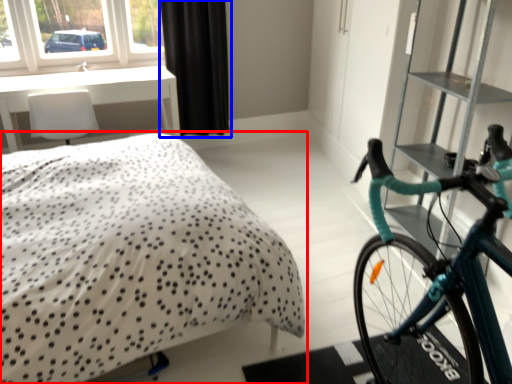
Question: Among these objects, which one is farthest to the camera, bed (highlighted by a red box) or curtain (highlighted by a blue box)?

Choices:
 (A) bed
 (B) curtain

Answer: (B)